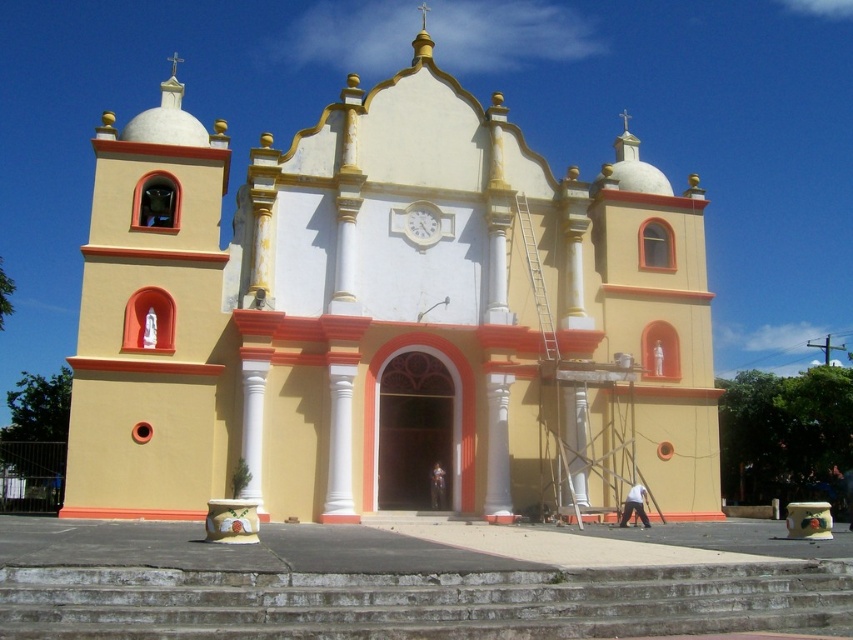
Question: Which point is closer to the camera?

Choices:
 (A) (590, 324)
 (B) (556, 634)

Answer: (B)

Question: Among these points, which one is nearest to the camera?

Choices:
 (A) (370, 292)
 (B) (422, 630)

Answer: (B)

Question: Observing the image, what is the correct spatial positioning of yellow matte church at center in reference to concrete stairs at center?

Choices:
 (A) above
 (B) below

Answer: (A)

Question: Is yellow matte church at center to the left of concrete stairs at center from the viewer's perspective?

Choices:
 (A) yes
 (B) no

Answer: (A)

Question: Which of the following is the farthest from the observer?

Choices:
 (A) (173, 150)
 (B) (274, 609)

Answer: (A)

Question: Is yellow matte church at center smaller than concrete stairs at center?

Choices:
 (A) no
 (B) yes

Answer: (A)